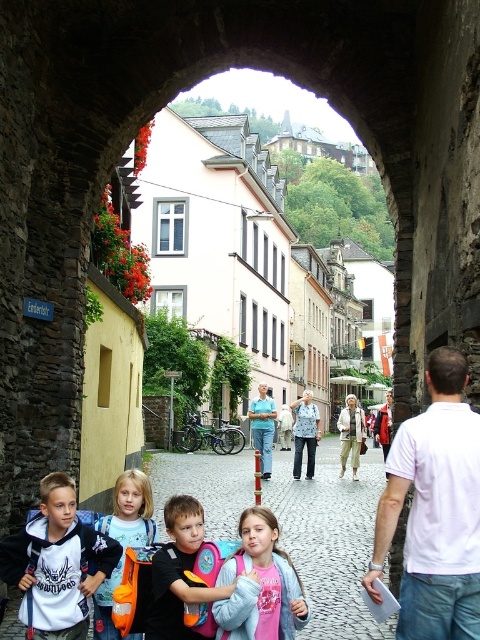
You are a photographer standing in the middle of the cobblestone street. You want to capture a photo that includes both the light blue shirt at center and the light beige fabric coat at center. Which clothing item will appear narrower in the photo?

The light blue shirt at center will appear narrower in the photo because it has a lesser width compared to the light beige fabric coat at center.

You are standing on the cobblestone street under the stone archway and see the light blue fabric backpack at lower left and the denim jacket at center. Which item is positioned higher in the image?

The light blue fabric backpack at lower left is located above the denim jacket at center, so it is positioned higher in the image.